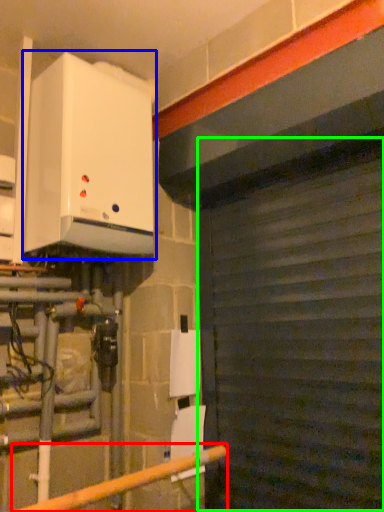
Question: Considering the real-world distances, which object is closest to rail (highlighted by a red box)? home appliance (highlighted by a blue box) or garage door (highlighted by a green box).

Choices:
 (A) home appliance
 (B) garage door

Answer: (B)